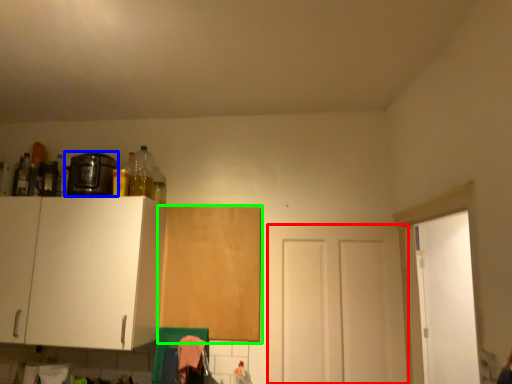
Question: Which object is positioned closest to door (highlighted by a red box)? Select from appliance (highlighted by a blue box) and cabinetry (highlighted by a green box).

Choices:
 (A) appliance
 (B) cabinetry

Answer: (B)